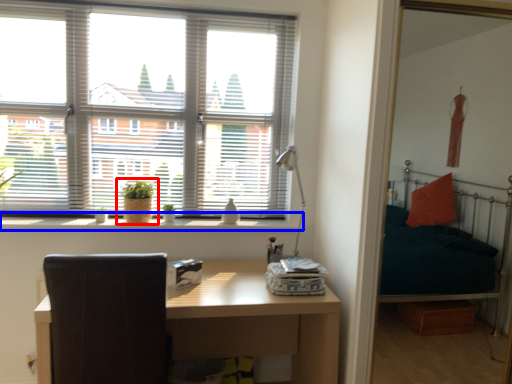
Question: Which point is closer to the camera, houseplant (highlighted by a red box) or window sill (highlighted by a blue box)?

Choices:
 (A) houseplant
 (B) window sill

Answer: (B)